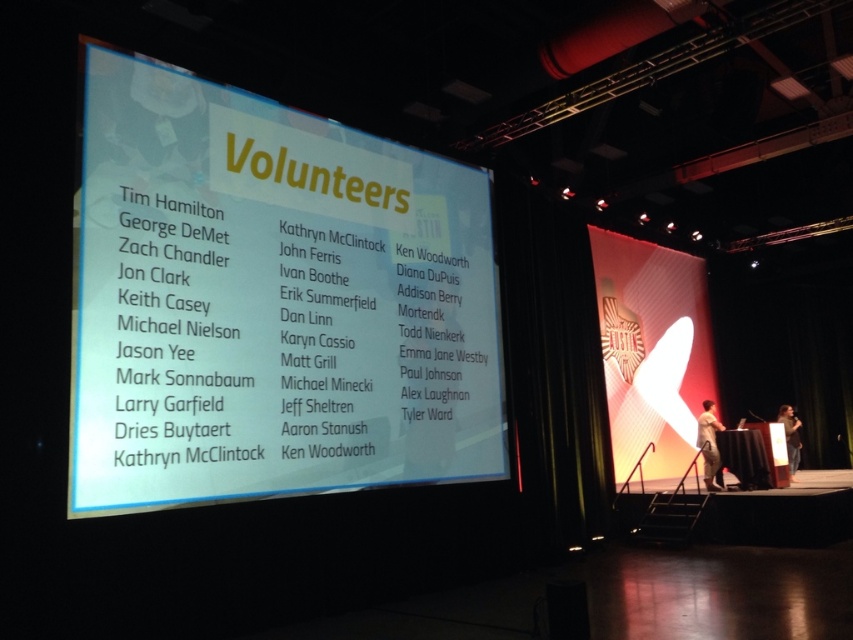
You are an attendee at the event and want to see both the white paper at center and the light brown fabric shirt at center. Which one is located higher in the image?

The white paper at center is above the light brown fabric shirt at center, so it is located higher in the image.